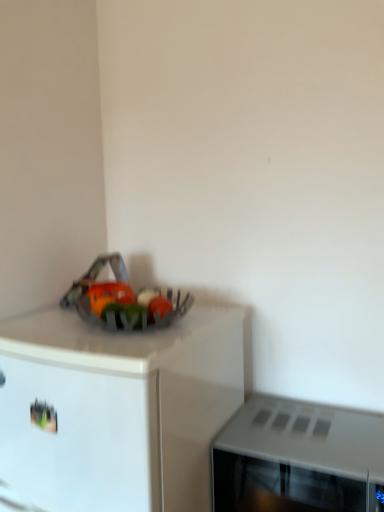
Question: Is metallic silver bowl at upper left bigger or smaller than gray matte microwave at right?

Choices:
 (A) big
 (B) small

Answer: (A)

Question: Visually, is metallic silver bowl at upper left positioned to the left or to the right of gray matte microwave at right?

Choices:
 (A) right
 (B) left

Answer: (B)

Question: From the image's perspective, is metallic silver bowl at upper left above or below gray matte microwave at right?

Choices:
 (A) below
 (B) above

Answer: (A)

Question: In terms of size, does gray matte microwave at right appear bigger or smaller than metallic silver bowl at upper left?

Choices:
 (A) big
 (B) small

Answer: (B)

Question: Relative to metallic silver bowl at upper left, is gray matte microwave at right in front or behind?

Choices:
 (A) front
 (B) behind

Answer: (B)

Question: Considering the positions of gray matte microwave at right and metallic silver bowl at upper left in the image, is gray matte microwave at right taller or shorter than metallic silver bowl at upper left?

Choices:
 (A) short
 (B) tall

Answer: (A)

Question: In terms of width, does gray matte microwave at right look wider or thinner when compared to metallic silver bowl at upper left?

Choices:
 (A) thin
 (B) wide

Answer: (A)